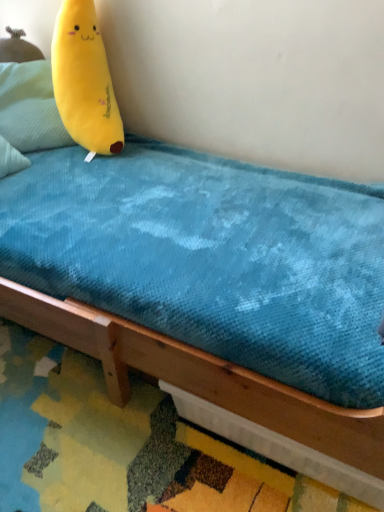
In order to click on yellow plush at upper left in this screenshot , I will do `click(30, 106)`.

Looking at this image, measure the distance between yellow plush at upper left and camera.

A distance of 1.68 meters exists between yellow plush at upper left and camera.

What is the approximate height of yellow plush at upper left?

The height of yellow plush at upper left is 39.11 centimeters.

This screenshot has width=384, height=512. What do you see at coordinates (30, 106) in the screenshot?
I see `yellow plush at upper left` at bounding box center [30, 106].

The image size is (384, 512). What do you see at coordinates (84, 80) in the screenshot?
I see `yellow plush at upper left` at bounding box center [84, 80].

Measure the distance between point (71, 113) and camera.

Point (71, 113) and camera are 5.42 feet apart from each other.

Where is `yellow plush at upper left`? This screenshot has width=384, height=512. yellow plush at upper left is located at coordinates (84, 80).

Identify the location of yellow plush at upper left. (30, 106).

Based on the photo, based on their positions, is yellow plush at upper left located to the left or right of yellow plush at upper left?

From the image, it's evident that yellow plush at upper left is to the right of yellow plush at upper left.

Which object is closer to the camera, yellow plush at upper left or yellow plush at upper left?

yellow plush at upper left.

Is point (103, 44) positioned before point (32, 103)?

That is True.

From the image's perspective, is yellow plush at upper left over yellow plush at upper left?

No, from the image's perspective, yellow plush at upper left is not on top of yellow plush at upper left.

From a real-world perspective, which is physically above, yellow plush at upper left or yellow plush at upper left?

In real-world perspective, yellow plush at upper left is above.

Between yellow plush at upper left and yellow plush at upper left, which one has smaller width?

yellow plush at upper left is thinner.

Considering the relative sizes of yellow plush at upper left and yellow plush at upper left in the image provided, is yellow plush at upper left taller than yellow plush at upper left?

Yes.

Based on their sizes in the image, would you say yellow plush at upper left is bigger or smaller than yellow plush at upper left?

yellow plush at upper left is bigger than yellow plush at upper left.

From the picture: Is yellow plush at upper left surrounded by yellow plush at upper left?

No, yellow plush at upper left is located outside of yellow plush at upper left.

Is yellow plush at upper left directly adjacent to yellow plush at upper left?

There is a gap between yellow plush at upper left and yellow plush at upper left.

Is yellow plush at upper left oriented away from yellow plush at upper left?

No, yellow plush at upper left is not facing the opposite direction of yellow plush at upper left.

Where is `banana in front of the yellow plush at upper left`? This screenshot has height=512, width=384. banana in front of the yellow plush at upper left is located at coordinates (84, 80).

Which object is positioned more to the right, yellow plush at upper left or yellow plush at upper left?

yellow plush at upper left is more to the right.

Considering the positions of objects yellow plush at upper left and yellow plush at upper left in the image provided, who is behind, yellow plush at upper left or yellow plush at upper left?

yellow plush at upper left is further away from the camera.

Is point (39, 144) closer or farther from the camera than point (83, 140)?

Point (39, 144) is positioned farther from the camera compared to point (83, 140).

From the image's perspective, is yellow plush at upper left beneath yellow plush at upper left?

Actually, yellow plush at upper left appears above yellow plush at upper left in the image.

In the scene shown: From a real-world perspective, is yellow plush at upper left above or below yellow plush at upper left?

In terms of real-world spatial position, yellow plush at upper left is below yellow plush at upper left.

Can you confirm if yellow plush at upper left is wider than yellow plush at upper left?

In fact, yellow plush at upper left might be narrower than yellow plush at upper left.

Does yellow plush at upper left have a greater height compared to yellow plush at upper left?

No.

Based on the photo, is yellow plush at upper left smaller than yellow plush at upper left?

Correct, yellow plush at upper left occupies less space than yellow plush at upper left.

Is yellow plush at upper left inside or outside of yellow plush at upper left?

yellow plush at upper left is not inside yellow plush at upper left, it's outside.

Is yellow plush at upper left not close to yellow plush at upper left?

No, yellow plush at upper left is not far away from yellow plush at upper left.

Is yellow plush at upper left positioned with its back to yellow plush at upper left?

No, yellow plush at upper left is not facing away from yellow plush at upper left.

How different are the orientations of yellow plush at upper left and yellow plush at upper left in degrees?

yellow plush at upper left and yellow plush at upper left are facing 0.0003 degrees away from each other.

How far apart are yellow plush at upper left and yellow plush at upper left?

yellow plush at upper left is 7.12 inches away from yellow plush at upper left.

Find the location of a particular element. pillow below the yellow plush at upper left (from a real-world perspective) is located at coordinates (30, 106).

Where is `banana on the right of yellow plush at upper left`? Image resolution: width=384 pixels, height=512 pixels. banana on the right of yellow plush at upper left is located at coordinates (84, 80).

Where is `banana in front of the yellow plush at upper left`? The width and height of the screenshot is (384, 512). banana in front of the yellow plush at upper left is located at coordinates (84, 80).